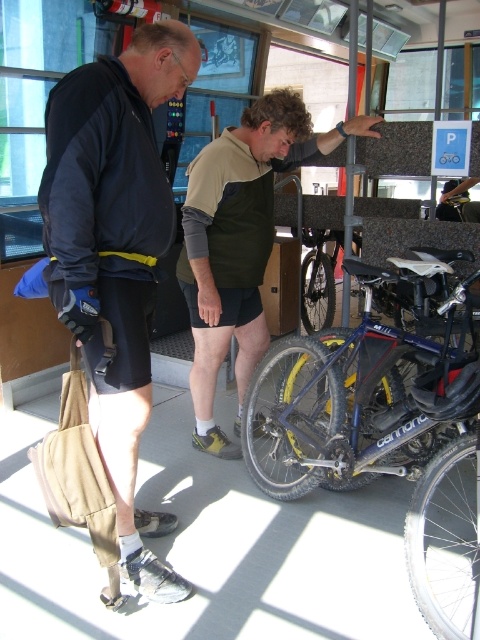
You are a delivery person who needs to place a package on a shelf that is 4 feet away from the blue metallic bicycle at center. Can you reach the shelf from where the matte black jacket at left is standing?

The matte black jacket at left is 3.33 feet from the blue metallic bicycle at center. Since the shelf is 4 feet away from the bicycle, the delivery person would need to move an additional 0.67 feet forward to reach the shelf.